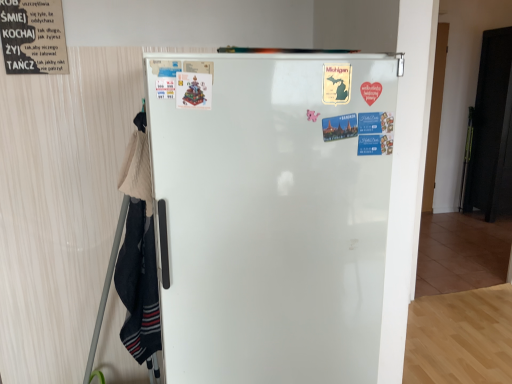
Find the location of a particular element. Image resolution: width=512 pixels, height=384 pixels. white glossy refrigerator at center is located at coordinates (273, 215).

The height and width of the screenshot is (384, 512). Identify the location of matte plastic poster at center, the second poster positioned from the top. (193, 90).

Where is `white glossy refrigerator at center`? The height and width of the screenshot is (384, 512). white glossy refrigerator at center is located at coordinates (273, 215).

Looking at the image, does matte plastic poster at center, positioned as the first poster in bottom-to-top order, seem bigger or smaller compared to white glossy refrigerator at center?

Considering their sizes, matte plastic poster at center, positioned as the first poster in bottom-to-top order, takes up less space than white glossy refrigerator at center.

Would you say matte plastic poster at center, positioned as the first poster in bottom-to-top order, contains white glossy refrigerator at center?

Actually, white glossy refrigerator at center is outside matte plastic poster at center, positioned as the first poster in bottom-to-top order.

Is matte plastic poster at center, positioned as the first poster in bottom-to-top order, at the right side of white glossy refrigerator at center?

No, matte plastic poster at center, positioned as the first poster in bottom-to-top order, is not to the right of white glossy refrigerator at center.

Does matte plastic poster at center, which is counted as the first poster, starting from the front, turn towards white glossy refrigerator at center?

Yes, matte plastic poster at center, which is counted as the first poster, starting from the front, is oriented towards white glossy refrigerator at center.

Which is behind, point (499, 128) or point (206, 79)?

The point (499, 128) is farther.

Considering the sizes of objects black matte door at right and matte plastic poster at center, arranged as the 1th poster when viewed from the right, in the image provided, who is shorter, black matte door at right or matte plastic poster at center, arranged as the 1th poster when viewed from the right,?

With less height is matte plastic poster at center, arranged as the 1th poster when viewed from the right.

Is there a large distance between black matte door at right and matte plastic poster at center, positioned as the first poster in bottom-to-top order?

Yes.

Is the position of black paper poster at upper left, which is the second poster from right to left, less distant than that of white glossy refrigerator at center?

No, black paper poster at upper left, which is the second poster from right to left, is behind white glossy refrigerator at center.

Is black paper poster at upper left, which is the first poster in left-to-right order, looking in the opposite direction of white glossy refrigerator at center?

No, white glossy refrigerator at center is not at the back of black paper poster at upper left, which is the first poster in left-to-right order.

Measure the distance from black paper poster at upper left, arranged as the first poster when viewed from the top, to white glossy refrigerator at center.

A distance of 37.34 inches exists between black paper poster at upper left, arranged as the first poster when viewed from the top, and white glossy refrigerator at center.

Looking at the image, does black paper poster at upper left, which is the first poster in left-to-right order, seem bigger or smaller compared to white glossy refrigerator at center?

Considering their sizes, black paper poster at upper left, which is the first poster in left-to-right order, takes up less space than white glossy refrigerator at center.

Can you confirm if white glossy refrigerator at center is positioned to the left of black paper poster at upper left, positioned as the second poster in front-to-back order?

In fact, white glossy refrigerator at center is to the right of black paper poster at upper left, positioned as the second poster in front-to-back order.

Is white glossy refrigerator at center looking in the opposite direction of black paper poster at upper left, which is the second poster from right to left?

That's not correct — white glossy refrigerator at center is not looking away from black paper poster at upper left, which is the second poster from right to left.

Which object is further away from the camera taking this photo, white glossy refrigerator at center or black paper poster at upper left, arranged as the first poster when viewed from the top?

black paper poster at upper left, arranged as the first poster when viewed from the top, is more distant.

From a real-world perspective, which is physically below, white glossy refrigerator at center or matte plastic poster at center, the 2th poster positioned from the left?

white glossy refrigerator at center, from a real-world perspective.

Looking at the image, does white glossy refrigerator at center seem bigger or smaller compared to matte plastic poster at center, the 2th poster positioned from the left?

In the image, white glossy refrigerator at center appears to be larger than matte plastic poster at center, the 2th poster positioned from the left.

Considering the positions of point (315, 78) and point (201, 103), is point (315, 78) closer or farther from the camera than point (201, 103)?

Point (315, 78) is farther from the camera than point (201, 103).

Locate an element on the screen. The image size is (512, 384). refrigerator on the right of matte plastic poster at center, the 2th poster positioned from the left is located at coordinates (273, 215).

Can you tell me how much black paper poster at upper left, the second poster positioned from the bottom, and matte plastic poster at center, arranged as the 1th poster when viewed from the right, differ in facing direction?

The angular difference between black paper poster at upper left, the second poster positioned from the bottom, and matte plastic poster at center, arranged as the 1th poster when viewed from the right, is 0.00148 degrees.

Is black paper poster at upper left, which is the second poster from right to left, next to matte plastic poster at center, the second poster positioned from the top?

black paper poster at upper left, which is the second poster from right to left, is not next to matte plastic poster at center, the second poster positioned from the top, and they're not touching.

From the image's perspective, between black paper poster at upper left, which is the first poster in left-to-right order, and matte plastic poster at center, arranged as the 1th poster when viewed from the right, who is located below?

From the image's view, matte plastic poster at center, arranged as the 1th poster when viewed from the right, is below.

Which is nearer, (57,37) or (208,99)?

Point (57,37) is positioned farther from the camera compared to point (208,99).

From a real-world perspective, between matte plastic poster at center, which is the 2th poster in back-to-front order, and black paper poster at upper left, which is the first poster in left-to-right order, who is vertically higher?

From a 3D spatial view, black paper poster at upper left, which is the first poster in left-to-right order, is above.

Is point (180, 103) positioned in front of point (49, 51)?

Yes.

Is matte plastic poster at center, the 2th poster positioned from the left, positioned far away from black paper poster at upper left, which is the first poster in left-to-right order?

matte plastic poster at center, the 2th poster positioned from the left, is actually quite close to black paper poster at upper left, which is the first poster in left-to-right order.

Which of these two, matte plastic poster at center, arranged as the 1th poster when viewed from the right, or black paper poster at upper left, the 1th poster in the back-to-front sequence, is bigger?

With larger size is black paper poster at upper left, the 1th poster in the back-to-front sequence.

This screenshot has width=512, height=384. Find the location of `refrigerator located on the right of matte plastic poster at center, which is the 2th poster in back-to-front order`. refrigerator located on the right of matte plastic poster at center, which is the 2th poster in back-to-front order is located at coordinates (273, 215).

Locate an element on the screen. poster that is the 1st one above the black matte door at right (from a real-world perspective) is located at coordinates (193, 90).

When comparing their distances from matte plastic poster at center, positioned as the first poster in bottom-to-top order, does white glossy refrigerator at center or black paper poster at upper left, the 1th poster in the back-to-front sequence, seem further?

black paper poster at upper left, the 1th poster in the back-to-front sequence.

From the image, which object appears to be nearer to black paper poster at upper left, which is the first poster in left-to-right order, white glossy refrigerator at center or black matte door at right?

white glossy refrigerator at center.

Which object lies further to the anchor point white glossy refrigerator at center, black paper poster at upper left, which is the first poster in left-to-right order, or black matte door at right?

Among the two, black matte door at right is located further to white glossy refrigerator at center.

Estimate the real-world distances between objects in this image. Which object is further from black paper poster at upper left, the 1th poster in the back-to-front sequence, matte plastic poster at center, arranged as the 1th poster when viewed from the right, or white glossy refrigerator at center?

Among the two, white glossy refrigerator at center is located further to black paper poster at upper left, the 1th poster in the back-to-front sequence.

Looking at the image, which one is located further to matte plastic poster at center, the 2th poster positioned from the left, black paper poster at upper left, the second poster positioned from the bottom, or black matte door at right?

black matte door at right.

Based on their spatial positions, is black paper poster at upper left, the second poster positioned from the bottom, or white glossy refrigerator at center closer to black matte door at right?

white glossy refrigerator at center is positioned closer to the anchor black matte door at right.

Looking at the image, which one is located further to black paper poster at upper left, positioned as the second poster in front-to-back order, black matte door at right or matte plastic poster at center, the 2th poster positioned from the left?

black matte door at right.

When comparing their distances from white glossy refrigerator at center, does matte plastic poster at center, the 2th poster positioned from the left, or black matte door at right seem further?

black matte door at right is further to white glossy refrigerator at center.

Where is `poster between black paper poster at upper left, positioned as the second poster in front-to-back order, and black matte door at right, in the horizontal direction`? poster between black paper poster at upper left, positioned as the second poster in front-to-back order, and black matte door at right, in the horizontal direction is located at coordinates (193, 90).

At what (x,y) coordinates should I click in order to perform the action: click on poster that lies between black paper poster at upper left, positioned as the second poster in front-to-back order, and white glossy refrigerator at center from top to bottom. Please return your answer as a coordinate pair (x, y). This screenshot has width=512, height=384. Looking at the image, I should click on (193, 90).